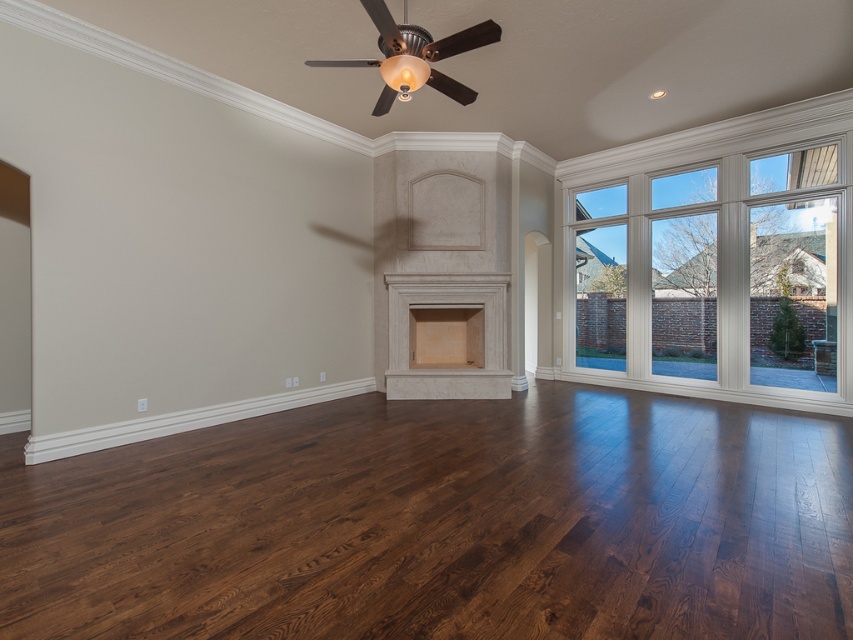
Question: Among these points, which one is farthest from the camera?

Choices:
 (A) (161, 460)
 (B) (473, 330)
 (C) (579, 285)

Answer: (C)

Question: Among these objects, which one is nearest to the camera?

Choices:
 (A) matte stone fireplace at center
 (B) dark brown wood flooring at center
 (C) matte beige fireplace at center

Answer: (B)

Question: Is dark brown wood flooring at center wider than clear glass windows at right?

Choices:
 (A) yes
 (B) no

Answer: (A)

Question: Is dark brown wood flooring at center to the right of clear glass windows at right from the viewer's perspective?

Choices:
 (A) yes
 (B) no

Answer: (B)

Question: Which object appears farthest from the camera in this image?

Choices:
 (A) matte stone fireplace at center
 (B) dark brown wood flooring at center

Answer: (A)

Question: Does dark brown wood flooring at center appear on the right side of clear glass windows at right?

Choices:
 (A) no
 (B) yes

Answer: (A)